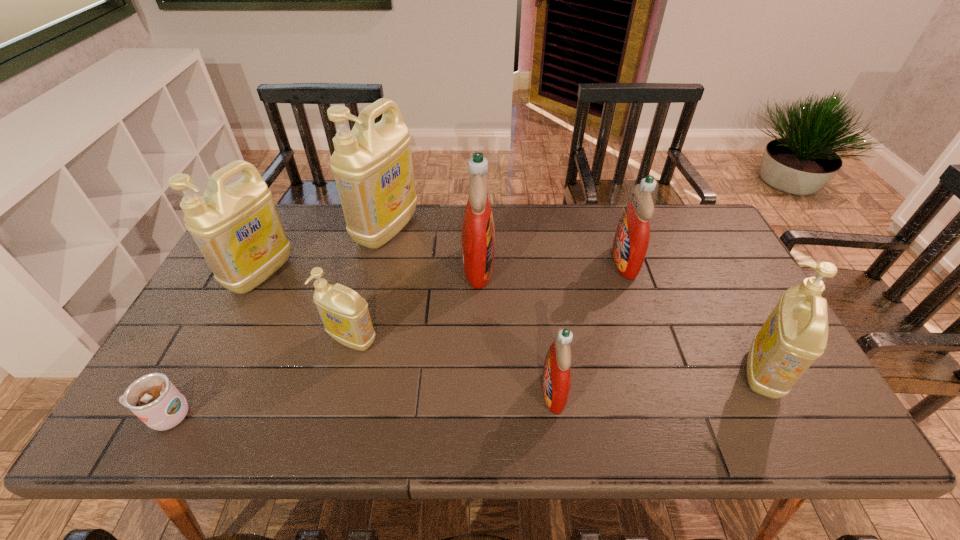
At what (x,y) coordinates should I click in order to perform the action: click on object located in the near left corner section of the desktop. Please return your answer as a coordinate pair (x, y). Looking at the image, I should click on (153, 398).

Identify the location of object that is at the near right corner. (795, 334).

The height and width of the screenshot is (540, 960). I want to click on vacant space at the far edge of the desktop, so click(578, 222).

The height and width of the screenshot is (540, 960). I want to click on vacant area at the near edge, so click(x=209, y=429).

Locate an element on the screen. free space at the right edge of the desktop is located at coordinates (750, 287).

Where is `vacant area at the far left corner of the desktop`? vacant area at the far left corner of the desktop is located at coordinates (301, 207).

The image size is (960, 540). In order to click on vacant space at the far right corner of the desktop in this screenshot , I will do `click(679, 226)`.

Find the location of a particular element. free spot between the leftmost beige detergent and the nearest red detergent is located at coordinates (407, 332).

What are the coordinates of `free space between the rightmost detergent and the third object from right to left` in the screenshot? It's located at (659, 382).

Locate an element on the screen. This screenshot has height=540, width=960. blank region between the smallest red detergent and the rightmost object is located at coordinates (659, 382).